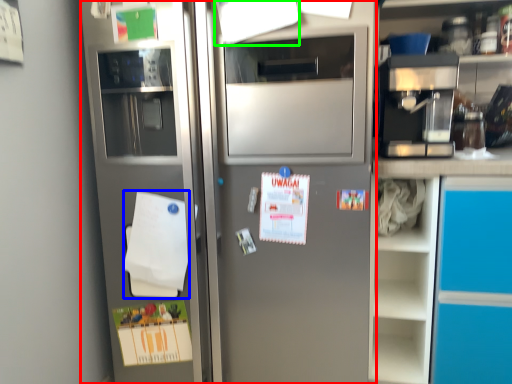
Question: Which object is positioned closest to refrigerator (highlighted by a red box)? Select from notepad (highlighted by a blue box) and paper (highlighted by a green box).

Choices:
 (A) notepad
 (B) paper

Answer: (A)